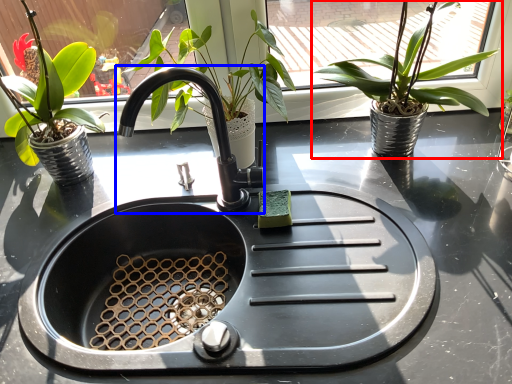
Question: Which of the following is the closest to the observer, houseplant (highlighted by a red box) or tap (highlighted by a blue box)?

Choices:
 (A) houseplant
 (B) tap

Answer: (B)